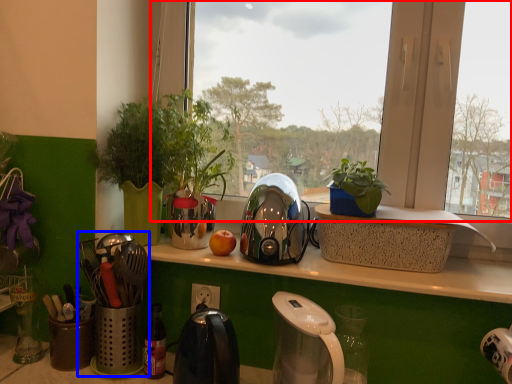
Question: Among these objects, which one is nearest to the camera, window (highlighted by a red box) or appliance (highlighted by a blue box)?

Choices:
 (A) window
 (B) appliance

Answer: (B)